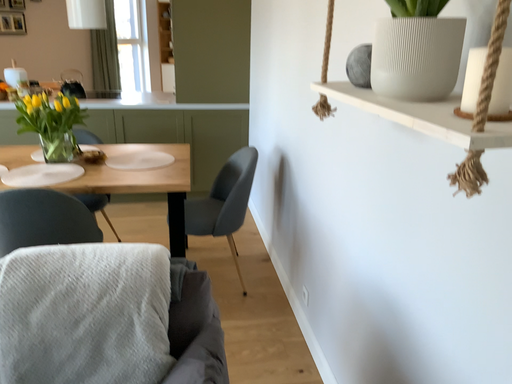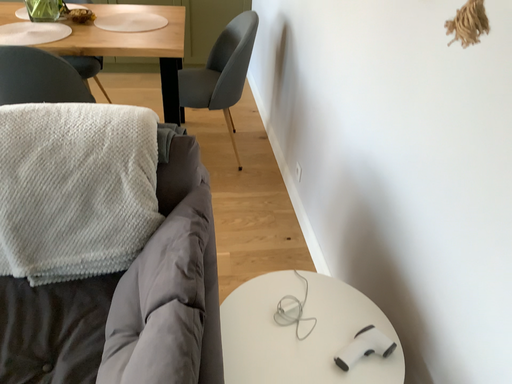
Question: How did the camera likely rotate when shooting the video?

Choices:
 (A) rotated downward
 (B) rotated upward

Answer: (A)